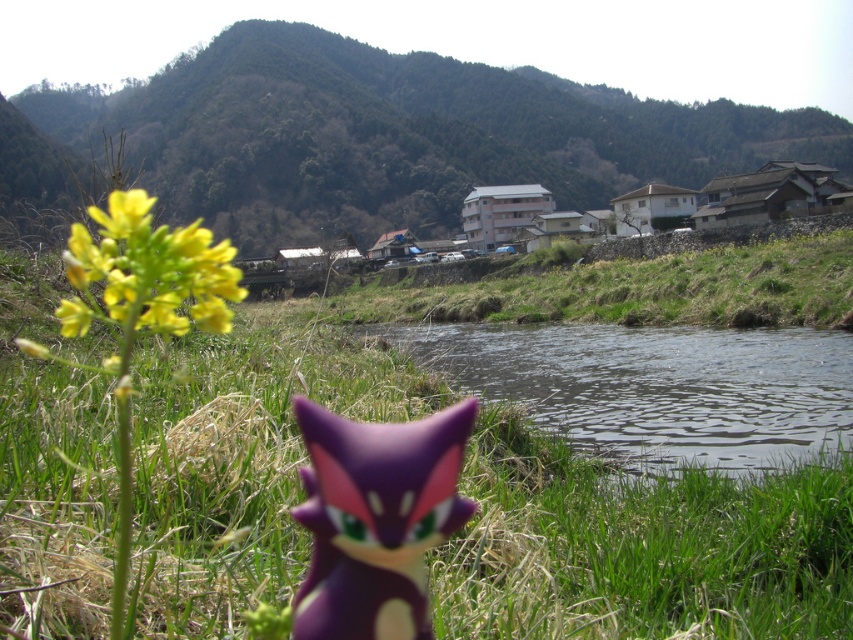
Question: Which point is farther from the camera taking this photo?

Choices:
 (A) (732, 372)
 (B) (666, 513)
 (C) (74, 324)
 (D) (424, 522)

Answer: (A)

Question: Which point is closer to the camera taking this photo?

Choices:
 (A) (103, 300)
 (B) (410, 120)
 (C) (360, 509)
 (D) (71, 424)

Answer: (A)

Question: Is green textured hillside at upper center smaller than transparent water at center?

Choices:
 (A) yes
 (B) no

Answer: (B)

Question: Can you confirm if green grass at center is thinner than green textured hillside at upper center?

Choices:
 (A) no
 (B) yes

Answer: (B)

Question: From the image, what is the correct spatial relationship of green textured hillside at upper center in relation to purple matte toy at center?

Choices:
 (A) right
 (B) left

Answer: (B)

Question: Which of these objects is positioned closest to the purple matte toy at center?

Choices:
 (A) green textured hillside at upper center
 (B) yellow matte flower at left
 (C) green grass at center

Answer: (C)